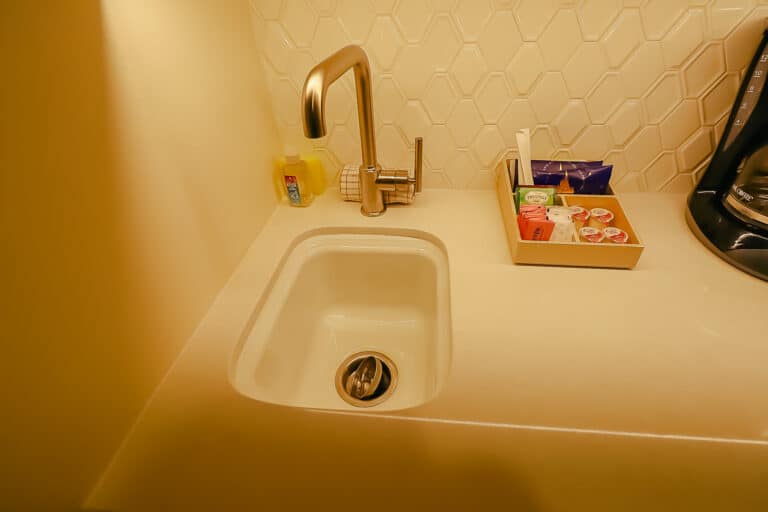
The image size is (768, 512). I want to click on coffee maker, so click(750, 192).